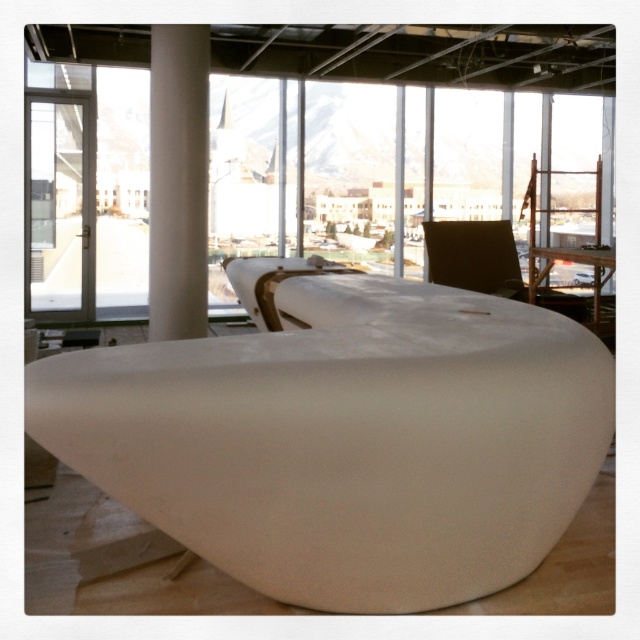
Can you confirm if white smooth column at center is thinner than brown leather chair at upper right?

Yes, white smooth column at center is thinner than brown leather chair at upper right.

Locate an element on the screen. Image resolution: width=640 pixels, height=640 pixels. white smooth column at center is located at coordinates (179, 180).